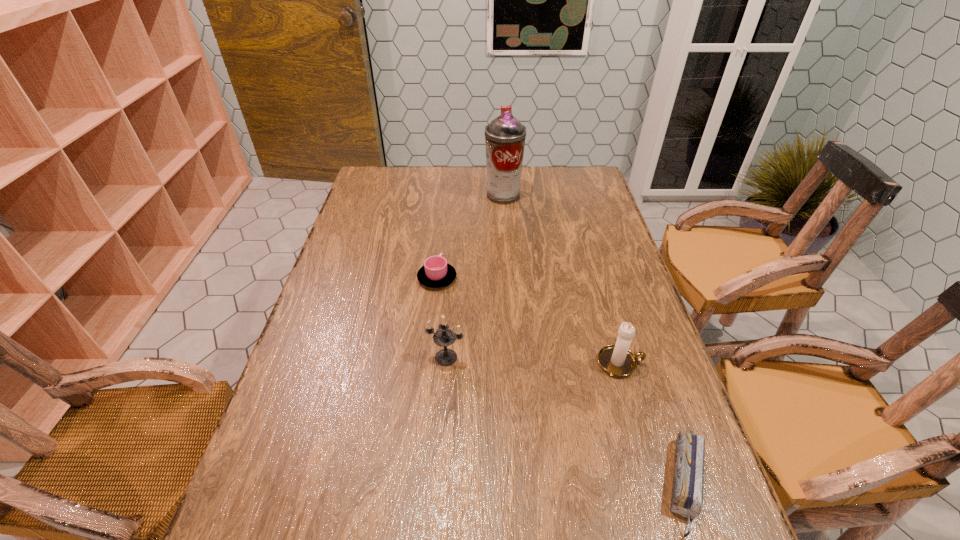
This screenshot has height=540, width=960. In order to click on the third object from left to right in this screenshot , I will do `click(505, 136)`.

The image size is (960, 540). I want to click on the farthest object, so click(505, 136).

Locate an element on the screen. the left candle holder is located at coordinates (443, 337).

Image resolution: width=960 pixels, height=540 pixels. I want to click on the right candle holder, so click(617, 360).

The width and height of the screenshot is (960, 540). I want to click on cup, so click(436, 273).

Where is `vacant space located on the left of the farthest object`? vacant space located on the left of the farthest object is located at coordinates (452, 195).

Locate an element on the screen. Image resolution: width=960 pixels, height=540 pixels. vacant area situated on the left of the left candle holder is located at coordinates (307, 357).

The height and width of the screenshot is (540, 960). I want to click on vacant space located on the side with the handle of the second farthest object, so 444,211.

This screenshot has width=960, height=540. Identify the location of vacant space located 0.210m on the side with the handle of the second farthest object. (443, 226).

Identify the location of vacant space located on the side with the handle of the second farthest object. This screenshot has height=540, width=960. (443, 227).